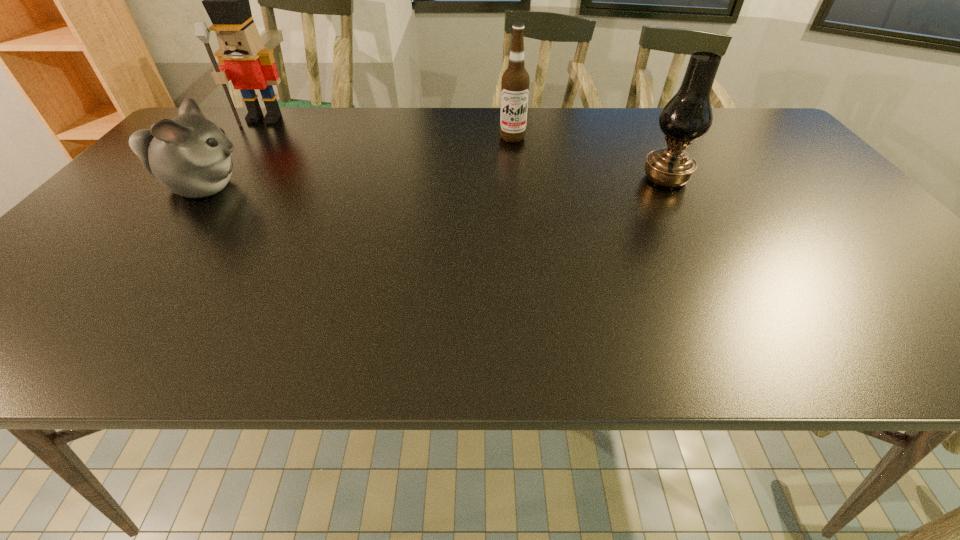
The width and height of the screenshot is (960, 540). Identify the location of nutcracker. (244, 60).

The width and height of the screenshot is (960, 540). Identify the location of alcohol. (515, 82).

I want to click on the second farthest object, so click(x=515, y=82).

Locate an element on the screen. The width and height of the screenshot is (960, 540). oil lamp is located at coordinates coord(688,116).

Find the location of a particular element. hamster is located at coordinates (189, 155).

The width and height of the screenshot is (960, 540). Identify the location of vacant region located 0.090m in front of the farthest object holding the staff. (246, 143).

Where is `free space located on the label of the third object from left to right`? The width and height of the screenshot is (960, 540). free space located on the label of the third object from left to right is located at coordinates (515, 154).

Find the location of `vacant space located 0.250m on the right of the rightmost object`. vacant space located 0.250m on the right of the rightmost object is located at coordinates (785, 179).

Where is `vacant space positioned on the face of the hamster`? vacant space positioned on the face of the hamster is located at coordinates (293, 187).

Where is `nutcracker located at the far edge`? This screenshot has height=540, width=960. nutcracker located at the far edge is located at coordinates (244, 60).